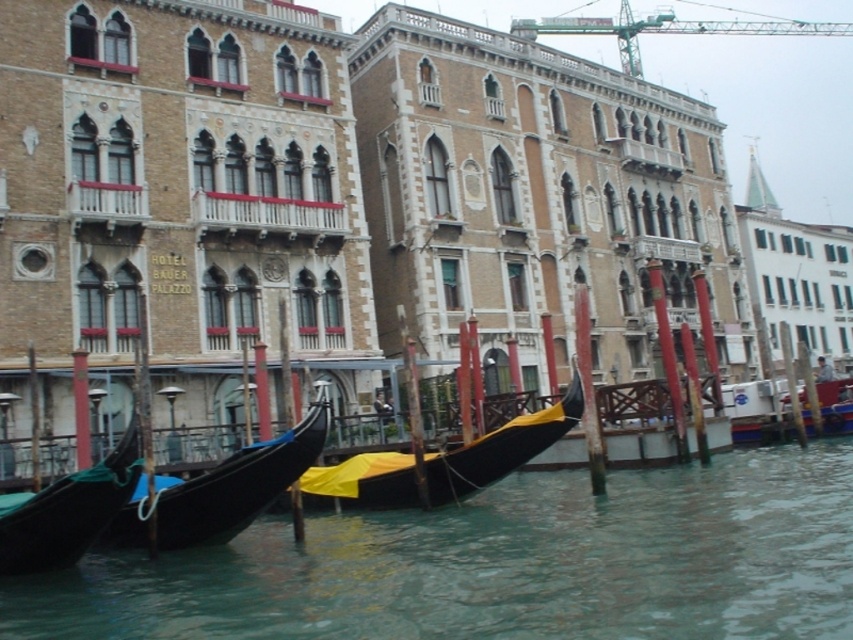
Question: Can you confirm if clear water at lower center is positioned below black glossy gondola at left?

Choices:
 (A) no
 (B) yes

Answer: (B)

Question: Based on their relative distances, which object is nearer to the black glossy gondola at center?

Choices:
 (A) black glossy gondola at left
 (B) clear water at lower center
 (C) black matte gondola at center
 (D) green metallic crane at upper center

Answer: (A)

Question: Does black glossy gondola at left appear over green metallic crane at upper center?

Choices:
 (A) no
 (B) yes

Answer: (A)

Question: Considering the real-world distances, which object is farthest from the black matte gondola at center?

Choices:
 (A) black glossy gondola at center
 (B) green metallic crane at upper center
 (C) clear water at lower center
 (D) black glossy gondola at left

Answer: (B)

Question: Among these points, which one is farthest from the camera?

Choices:
 (A) (114, 500)
 (B) (538, 557)

Answer: (B)

Question: Can you confirm if black matte gondola at center is bigger than green metallic crane at upper center?

Choices:
 (A) yes
 (B) no

Answer: (B)